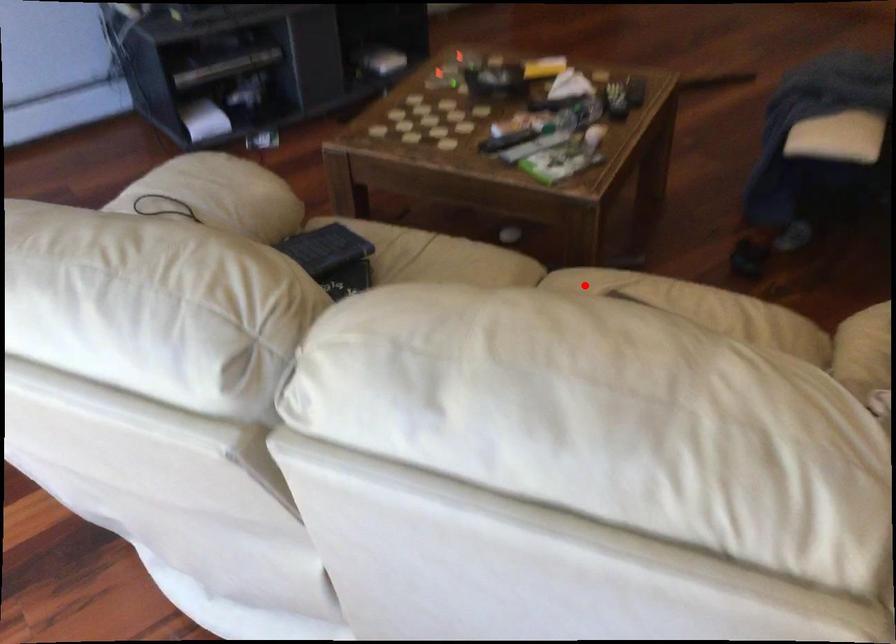
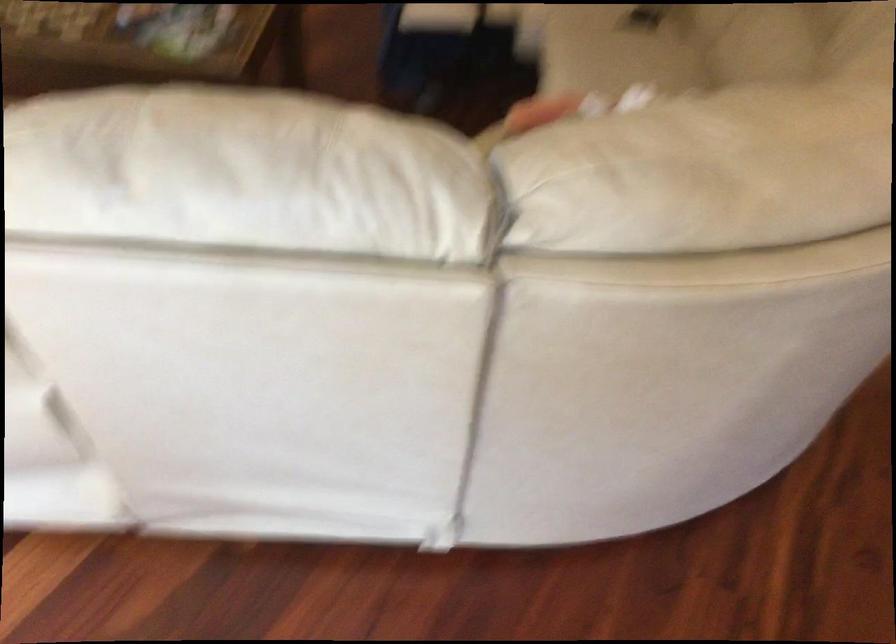
Question: I am providing you with two images of the same scene from different viewpoints. A red point is marked on the first image. Can you still see the location of the red point in image 2?

Choices:
 (A) Yes
 (B) No

Answer: (B)